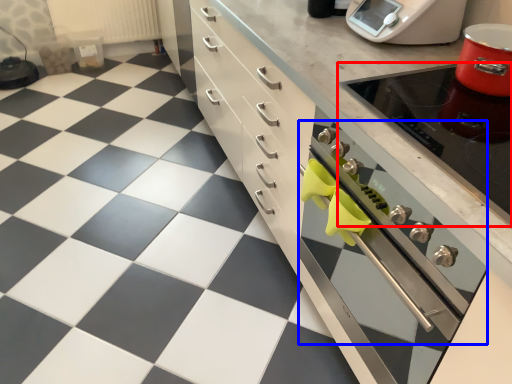
Question: Which object appears farthest to the camera in this image, appliance (highlighted by a red box) or oven (highlighted by a blue box)?

Choices:
 (A) appliance
 (B) oven

Answer: (A)